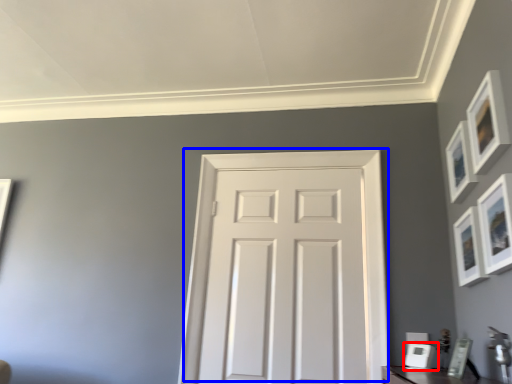
Question: Which of the following is the farthest to the observer, picture frame (highlighted by a red box) or door (highlighted by a blue box)?

Choices:
 (A) picture frame
 (B) door

Answer: (B)